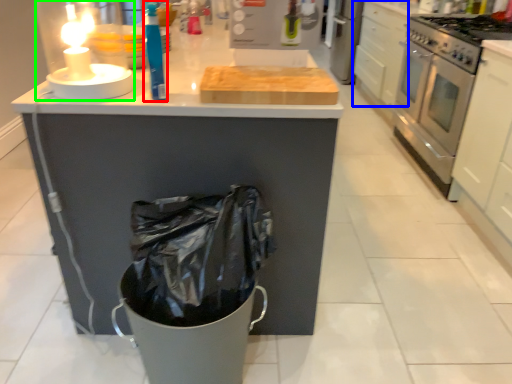
Question: Considering the real-world distances, which object is farthest from cleaning product (highlighted by a red box)? drawer (highlighted by a blue box) or candle holder (highlighted by a green box)?

Choices:
 (A) drawer
 (B) candle holder

Answer: (A)